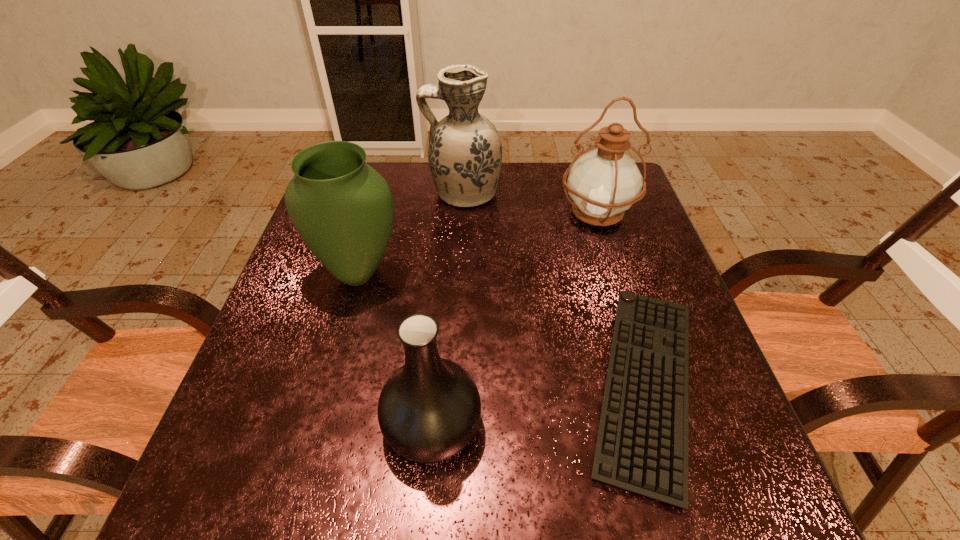
Where is `vacant area between the oil lamp and the farthest vase`? This screenshot has width=960, height=540. vacant area between the oil lamp and the farthest vase is located at coordinates point(530,203).

At what (x,y) coordinates should I click in order to perform the action: click on vacant area between the nearest vase and the farthest vase. Please return your answer as a coordinate pair (x, y). The width and height of the screenshot is (960, 540). Looking at the image, I should click on (447, 309).

The height and width of the screenshot is (540, 960). In order to click on free space between the farthest vase and the oil lamp in this screenshot , I will do `click(530, 203)`.

The image size is (960, 540). Find the location of `free space between the oil lamp and the leftmost object`. free space between the oil lamp and the leftmost object is located at coordinates tap(478, 244).

This screenshot has height=540, width=960. I want to click on empty space between the oil lamp and the leftmost object, so click(x=478, y=244).

This screenshot has width=960, height=540. Find the location of `free spot between the oil lamp and the nearest vase`. free spot between the oil lamp and the nearest vase is located at coordinates (515, 319).

Find the location of a particular element. This screenshot has width=960, height=540. object that can be found as the closest to the leftmost object is located at coordinates (465, 152).

Identify which object is the fourth nearest to the nearest vase. Please provide its 2D coordinates. Your answer should be formatted as a tuple, i.e. [(x, y)], where the tuple contains the x and y coordinates of a point satisfying the conditions above.

[(465, 152)]

This screenshot has height=540, width=960. What are the coordinates of `vase that is the third nearest to the shortest object` in the screenshot? It's located at (343, 209).

Where is `vase that is the closest to the nearest vase`? vase that is the closest to the nearest vase is located at coordinates (343, 209).